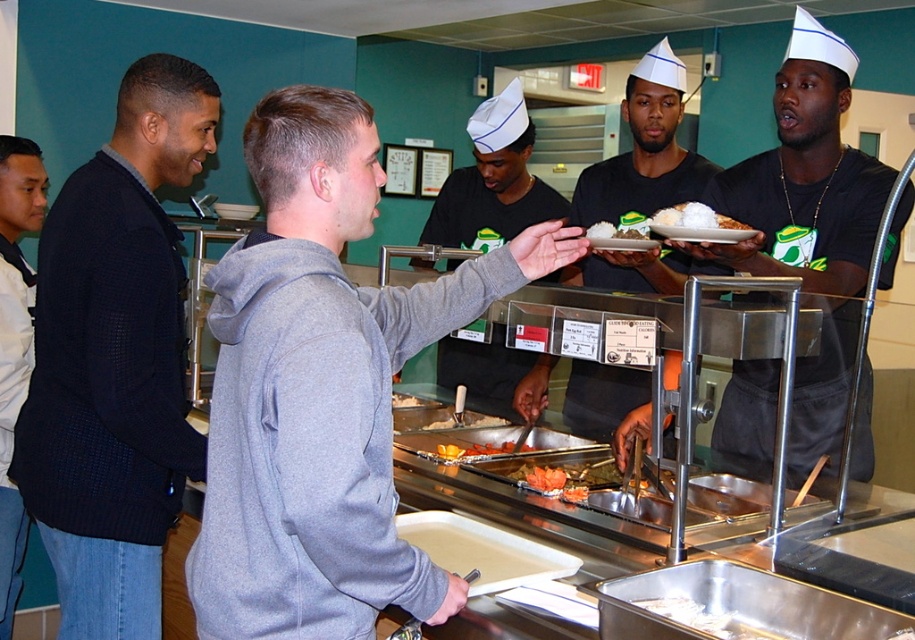
You are a server in the cafeteria and need to address the two customers at the left. Which customer is shorter in height between the dark blue sweater at left and the white shirt at left?

The dark blue sweater at left is shorter than the white shirt at left.

You are standing at the food station in the cafeteria and see two points marked on the floor. The first point is at coordinate point (130,580) and the second is at point (31,220). If you want to walk towards the point that is closer to the entrance of the cafeteria, which coordinate should you head towards?

Point (31,220) is behind point (130,580). Since you want to go towards the entrance, you should head towards point (31,220) because it is closer to the entrance.

Consider the image. You are a customer in the cafeteria and see the black matte shirt at center and the white glossy rice at center. Which object is positioned to the right side?

The black matte shirt at center is positioned to the right of the white glossy rice at center.